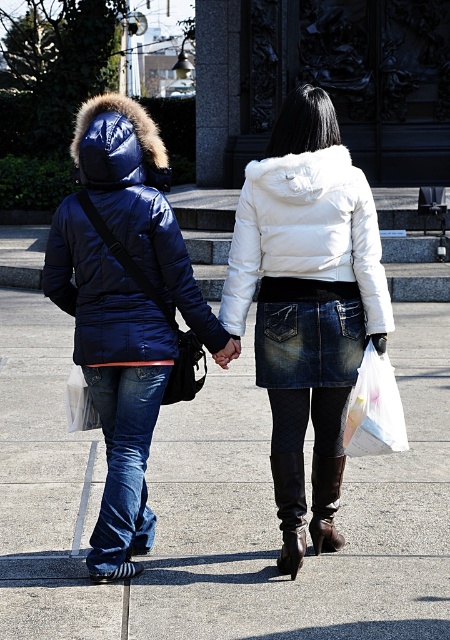
Question: Considering the relative positions of smooth concrete pavement at center and matte blue jacket at center in the image provided, where is smooth concrete pavement at center located with respect to matte blue jacket at center?

Choices:
 (A) right
 (B) left

Answer: (A)

Question: Which point is closer to the camera?

Choices:
 (A) (153, 348)
 (B) (373, 241)
 (C) (351, 252)
 (D) (382, 353)

Answer: (A)

Question: Which object is farther from the camera taking this photo?

Choices:
 (A) matte blue jacket at center
 (B) translucent plastic bag at lower right
 (C) white fluffy coat at center
 (D) white fur-lined jacket at center

Answer: (D)

Question: Is smooth concrete pavement at center bigger than translucent plastic bag at lower right?

Choices:
 (A) no
 (B) yes

Answer: (B)

Question: Based on their relative distances, which object is nearer to the matte blue jacket at center?

Choices:
 (A) white fluffy coat at center
 (B) matte blue puffer jacket at left
 (C) denim skirt at center

Answer: (A)

Question: Is matte blue puffer jacket at left thinner than denim skirt at center?

Choices:
 (A) yes
 (B) no

Answer: (B)